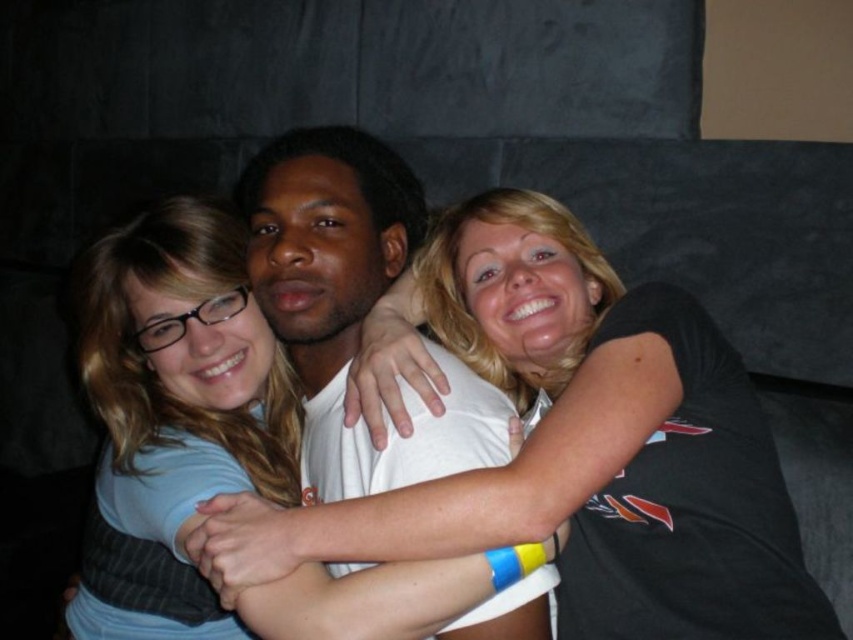
You are designing a layout for a magazine cover featuring the three people on the couch. The magazine requires that the two blue shirts must be at least 1 inch apart for visual clarity. Based on the image, will the current placement of the light blue fabric shirt at center and the matte blue shirt at center meet this requirement?

The light blue fabric shirt at center and the matte blue shirt at center are only 0.69 inches apart, which is less than the required 1 inch. Therefore, the current placement does not meet the magazine cover requirement for visual clarity between the two blue shirts.